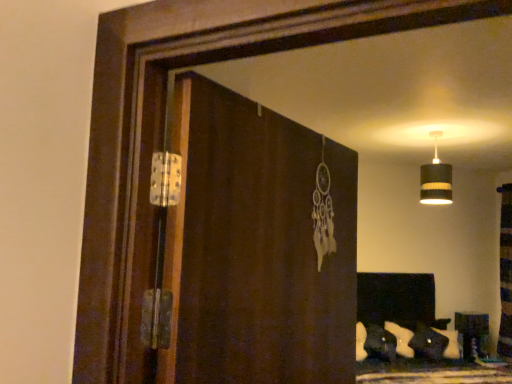
You are a GUI agent. You are given a task and a screenshot of the screen. Output one action in this format:
    pyautogui.click(x=<x>, y=<y>)
    Task: Click on the black striped lampshade at upper right
    The width and height of the screenshot is (512, 384).
    Given the screenshot: What is the action you would take?
    pyautogui.click(x=436, y=179)

Find the location of a particular element. The image size is (512, 384). brown wooden screen door at center is located at coordinates (259, 246).

Find the location of a particular element. wooden bookshelf at right is located at coordinates (472, 334).

How different are the orientations of brown wooden screen door at center and black striped lampshade at upper right in degrees?

45.7 degrees.

Which is behind, point (189, 119) or point (421, 201)?

Point (421, 201)

Can you confirm if brown wooden screen door at center is bigger than black striped lampshade at upper right?

Indeed, brown wooden screen door at center has a larger size compared to black striped lampshade at upper right.

Can you tell me how much brown wooden screen door at center and wooden bookshelf at right differ in facing direction?

36.9 degrees separate the facing orientations of brown wooden screen door at center and wooden bookshelf at right.

Considering their positions, is brown wooden screen door at center located in front of or behind wooden bookshelf at right?

brown wooden screen door at center is positioned closer to the viewer than wooden bookshelf at right.

Find the location of a particular element. The image size is (512, 384). furniture lying on the right of brown wooden screen door at center is located at coordinates (472, 334).

Does brown wooden screen door at center turn towards wooden bookshelf at right?

No.

Which object is positioned more to the left, wooden bookshelf at right or brown wooden screen door at center?

brown wooden screen door at center.

Which object is thinner, wooden bookshelf at right or brown wooden screen door at center?

brown wooden screen door at center is thinner.

Where is `furniture behind the brown wooden screen door at center`? This screenshot has height=384, width=512. furniture behind the brown wooden screen door at center is located at coordinates (472, 334).

From the picture: Is wooden bookshelf at right surrounding brown wooden screen door at center?

No, wooden bookshelf at right does not contain brown wooden screen door at center.

Who is taller, black striped lampshade at upper right or brown wooden screen door at center?

brown wooden screen door at center.

Can you tell me how much black striped lampshade at upper right and brown wooden screen door at center differ in facing direction?

The angle between the facing direction of black striped lampshade at upper right and the facing direction of brown wooden screen door at center is 45.7 degrees.

Between black striped lampshade at upper right and brown wooden screen door at center, which one has larger size?

With larger size is brown wooden screen door at center.

From a real-world perspective, who is located lower, black striped lampshade at upper right or brown wooden screen door at center?

In real-world perspective, brown wooden screen door at center is lower.

At what (x,y) coordinates should I click in order to perform the action: click on furniture that is on the right side of black striped lampshade at upper right. Please return your answer as a coordinate pair (x, y). Looking at the image, I should click on (472, 334).

How many degrees apart are the facing directions of wooden bookshelf at right and black striped lampshade at upper right?

They differ by 8.82 degrees in their facing directions.

Is wooden bookshelf at right positioned beyond the bounds of black striped lampshade at upper right?

That's correct, wooden bookshelf at right is outside of black striped lampshade at upper right.

Is wooden bookshelf at right facing away from black striped lampshade at upper right?

No, wooden bookshelf at right is not facing the opposite direction of black striped lampshade at upper right.

Does black striped lampshade at upper right contain wooden bookshelf at right?

No, wooden bookshelf at right is located outside of black striped lampshade at upper right.

Considering the sizes of objects black striped lampshade at upper right and wooden bookshelf at right in the image provided, who is wider, black striped lampshade at upper right or wooden bookshelf at right?

With larger width is black striped lampshade at upper right.

Which is closer to the camera, (448,202) or (468,329)?

Point (448,202) appears to be closer to the viewer than point (468,329).

This screenshot has width=512, height=384. I want to click on lamp on the right side of brown wooden screen door at center, so click(x=436, y=179).

This screenshot has width=512, height=384. Identify the location of screen door located above the wooden bookshelf at right (from a real-world perspective). (259, 246).

From the image, which object appears to be nearer to black striped lampshade at upper right, wooden bookshelf at right or brown wooden screen door at center?

wooden bookshelf at right is positioned closer to the anchor black striped lampshade at upper right.

Based on their spatial positions, is black striped lampshade at upper right or brown wooden screen door at center closer to wooden bookshelf at right?

The object closer to wooden bookshelf at right is black striped lampshade at upper right.

From the image, which object appears to be farther from wooden bookshelf at right, brown wooden screen door at center or black striped lampshade at upper right?

The object further to wooden bookshelf at right is brown wooden screen door at center.

When comparing their distances from black striped lampshade at upper right, does brown wooden screen door at center or wooden bookshelf at right seem further?

brown wooden screen door at center is positioned further to the anchor black striped lampshade at upper right.

Considering their positions, is wooden bookshelf at right positioned closer to brown wooden screen door at center than black striped lampshade at upper right?

black striped lampshade at upper right is closer to brown wooden screen door at center.

From the image, which object appears to be farther from brown wooden screen door at center, black striped lampshade at upper right or wooden bookshelf at right?

wooden bookshelf at right lies further to brown wooden screen door at center than the other object.

I want to click on lamp between brown wooden screen door at center and wooden bookshelf at right from front to back, so click(436, 179).